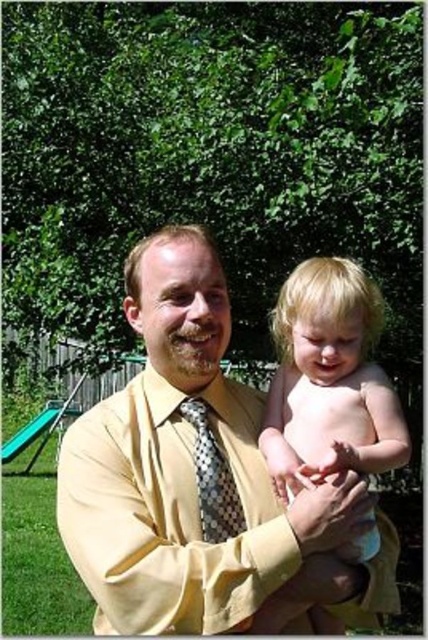
Question: Does yellow satin shirt at center have a greater width compared to blonde hair at center?

Choices:
 (A) no
 (B) yes

Answer: (B)

Question: Can you confirm if yellow satin shirt at center is positioned to the right of blonde hair at center?

Choices:
 (A) yes
 (B) no

Answer: (B)

Question: Does yellow satin shirt at center appear on the right side of blonde hair at center?

Choices:
 (A) yes
 (B) no

Answer: (B)

Question: Considering the real-world distances, which object is closest to the polka dot silk tie at center?

Choices:
 (A) yellow satin shirt at center
 (B) blonde hair at center

Answer: (A)

Question: Which of these objects is positioned closest to the blonde hair at center?

Choices:
 (A) polka dot silk tie at center
 (B) yellow satin shirt at center

Answer: (A)

Question: Which object is closer to the camera taking this photo?

Choices:
 (A) blonde hair at center
 (B) yellow satin shirt at center

Answer: (B)